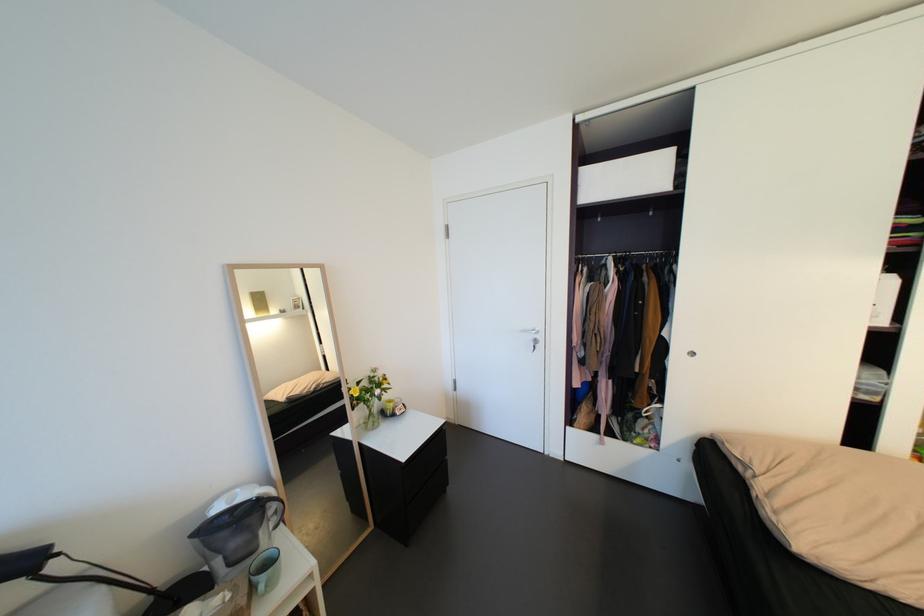
The width and height of the screenshot is (924, 616). In order to click on silver door handle in this screenshot , I will do `click(550, 336)`.